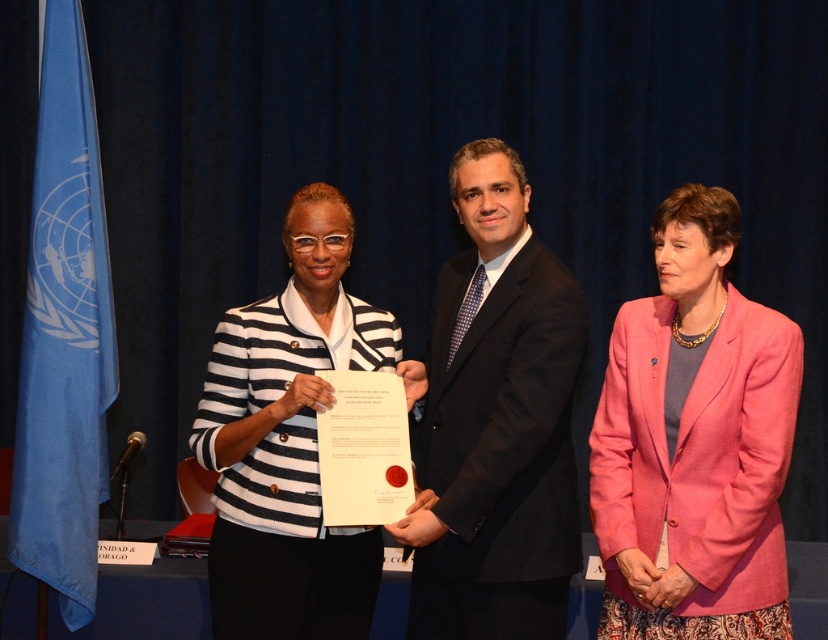
What is the color of the fabric at point (694,442)?

The fabric at point (694,442) is pink.

You are an event photographer who needs to capture a clear photo of both the pink fabric jacket at center and the white striped blazer at center. Which one should you focus on first to ensure both are in focus?

The pink fabric jacket at center is in front of the white striped blazer at center, so you should focus on the pink fabric jacket at center first to ensure both are in focus.